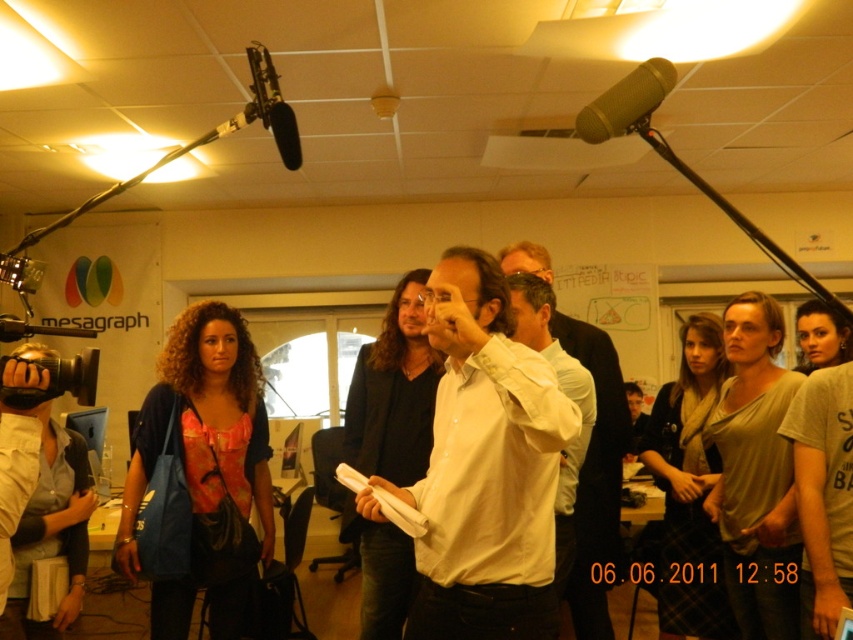
Question: From the image, what is the correct spatial relationship of white matte shirt at center in relation to gold metallic microphone at upper center?

Choices:
 (A) right
 (B) left

Answer: (B)

Question: From the image, what is the correct spatial relationship of white matte shirt at center in relation to gold metallic microphone at upper center?

Choices:
 (A) above
 (B) below

Answer: (B)

Question: Among these points, which one is nearest to the camera?

Choices:
 (A) (659, 84)
 (B) (509, 344)

Answer: (A)

Question: Which object is closer to the camera taking this photo?

Choices:
 (A) white shirt at center
 (B) gold metallic microphone at upper center

Answer: (B)

Question: Can you confirm if white shirt at center is positioned above gold metallic microphone at upper center?

Choices:
 (A) no
 (B) yes

Answer: (A)

Question: Which point is farther to the camera?

Choices:
 (A) (590, 624)
 (B) (613, 92)
 (C) (511, 449)

Answer: (A)